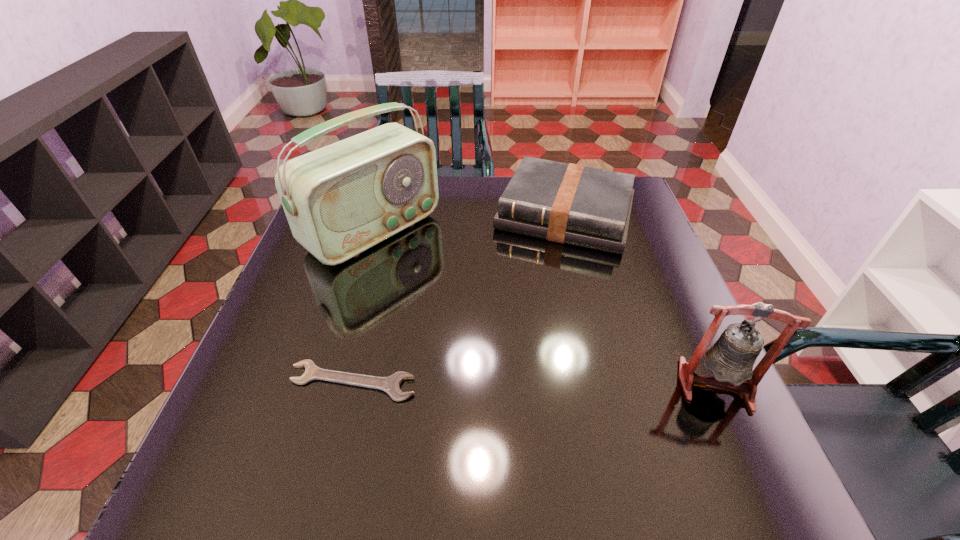
The image size is (960, 540). Identify the location of object situated at the far left corner. (342, 199).

At what (x,y) coordinates should I click in order to perform the action: click on object that is at the near left corner. Please return your answer as a coordinate pair (x, y). Looking at the image, I should click on (391, 385).

The width and height of the screenshot is (960, 540). I want to click on object that is at the far right corner, so click(x=568, y=203).

Find the location of a particular element. This screenshot has height=540, width=960. object that is at the near right corner is located at coordinates (731, 358).

Where is `vacant space at the near edge`? vacant space at the near edge is located at coordinates click(530, 436).

The image size is (960, 540). In the image, there is a desktop. Find the location of `vacant space at the left edge`. vacant space at the left edge is located at coordinates (339, 290).

The image size is (960, 540). I want to click on free space at the right edge, so click(x=620, y=282).

Locate an element on the screen. The width and height of the screenshot is (960, 540). free spot between the tallest object and the bell is located at coordinates (544, 308).

Where is `free space between the second shortest object and the shortest object`? Image resolution: width=960 pixels, height=540 pixels. free space between the second shortest object and the shortest object is located at coordinates (459, 299).

This screenshot has width=960, height=540. What are the coordinates of `free space between the second tallest object and the wrench` in the screenshot? It's located at (534, 383).